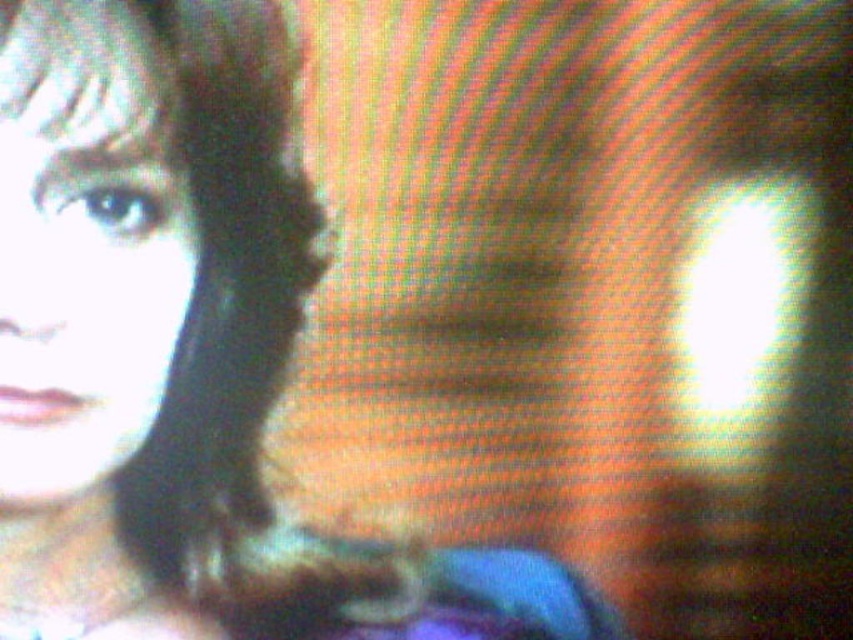
You are an AI analyzing a low quality image of a person. You see two hair strands labeled as matte black hair at upper left and smooth black hair at upper left. Which hair strand is nearer to you?

The matte black hair at upper left is closer to the viewer than smooth black hair at upper left.

Based on the scene description, can you determine the color of the object located at point (184, 352)?

The object at point (184, 352) is matte black hair at upper left, so its color is matte black.

Based on the image description, can you determine which object is larger between the matte black hair at upper left and the smooth skin face at upper left?

The matte black hair at upper left is bigger than the smooth skin face at upper left according to the description.